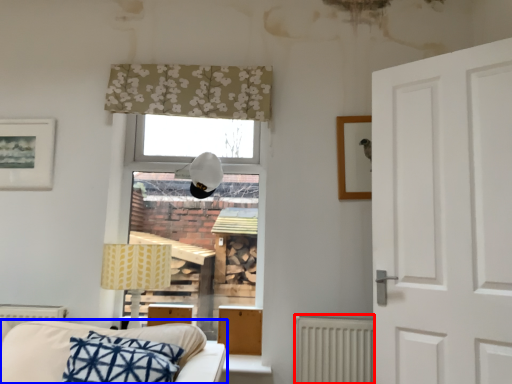
Question: Which of the following is the farthest to the observer, radiator (highlighted by a red box) or studio couch (highlighted by a blue box)?

Choices:
 (A) radiator
 (B) studio couch

Answer: (A)